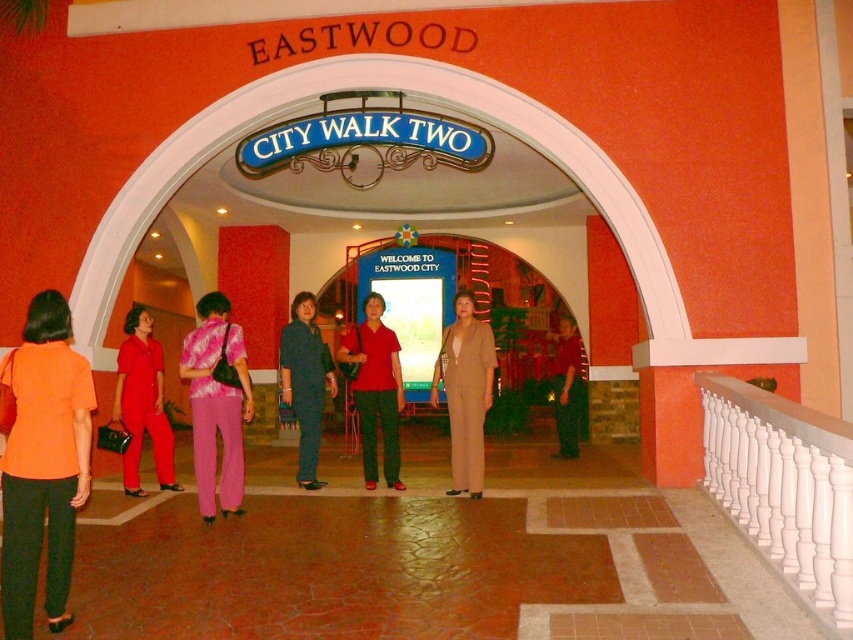
Between white glossy balustrade at right and tan fabric suit at center, which one is positioned higher?

tan fabric suit at center is higher up.

The image size is (853, 640). I want to click on white glossy balustrade at right, so click(784, 486).

Between pink satin blouse at center and tan fabric suit at center, which one appears on the left side from the viewer's perspective?

pink satin blouse at center is more to the left.

What do you see at coordinates (216, 404) in the screenshot? This screenshot has width=853, height=640. I see `pink satin blouse at center` at bounding box center [216, 404].

Locate an element on the screen. The height and width of the screenshot is (640, 853). pink satin blouse at center is located at coordinates (216, 404).

Which is below, orange matte shirt at left or tan fabric suit at center?

orange matte shirt at left

Which is behind, point (65, 566) or point (482, 358)?

The point (482, 358) is behind.

Identify the location of orange matte shirt at left. The image size is (853, 640). (44, 461).